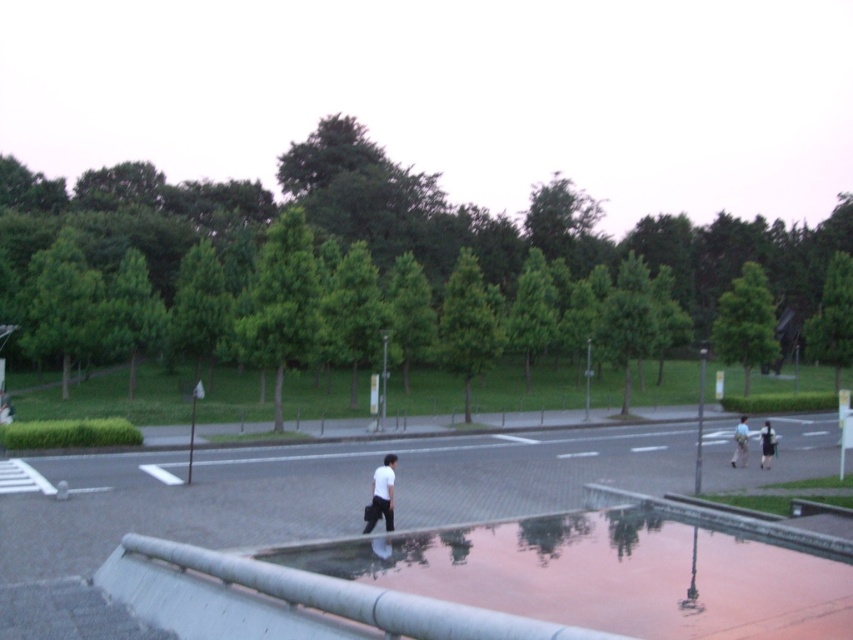
Which is more to the left, white matte shirt at center or dark blue jeans at center?

Positioned to the left is white matte shirt at center.

Is white matte shirt at center smaller than dark blue jeans at center?

Yes.

Which is behind, point (363, 531) or point (773, 438)?

Point (773, 438)

You are a GUI agent. You are given a task and a screenshot of the screen. Output one action in this format:
    pyautogui.click(x=<x>, y=<y>)
    Task: Click on the white matte shirt at center
    Image resolution: width=853 pixels, height=640 pixels.
    Given the screenshot: What is the action you would take?
    pyautogui.click(x=381, y=496)

Is light blue shirt at right to the left of dark blue jeans at center from the viewer's perspective?

Correct, you'll find light blue shirt at right to the left of dark blue jeans at center.

Does light blue shirt at right appear over dark blue jeans at center?

Correct, light blue shirt at right is located above dark blue jeans at center.

Who is more forward, (740, 464) or (763, 465)?

Point (763, 465)

I want to click on light blue shirt at right, so click(x=740, y=442).

Does reflective glass puddle at center have a smaller size compared to light blue shirt at right?

Yes.

Does reflective glass puddle at center have a larger size compared to light blue shirt at right?

Incorrect, reflective glass puddle at center is not larger than light blue shirt at right.

The image size is (853, 640). I want to click on reflective glass puddle at center, so click(611, 572).

The height and width of the screenshot is (640, 853). What are the coordinates of `reflective glass puddle at center` in the screenshot? It's located at (611, 572).